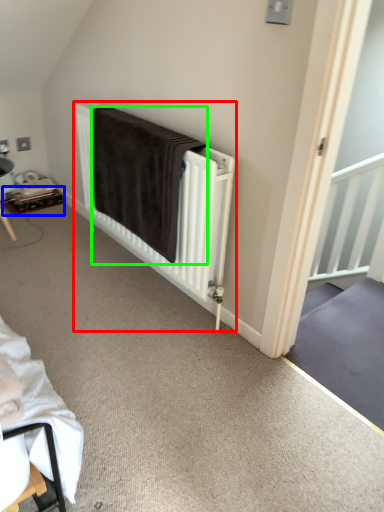
Question: Based on their relative distances, which object is nearer to bed (highlighted by a red box)? Choose from table (highlighted by a blue box) and blanket (highlighted by a green box).

Choices:
 (A) table
 (B) blanket

Answer: (B)